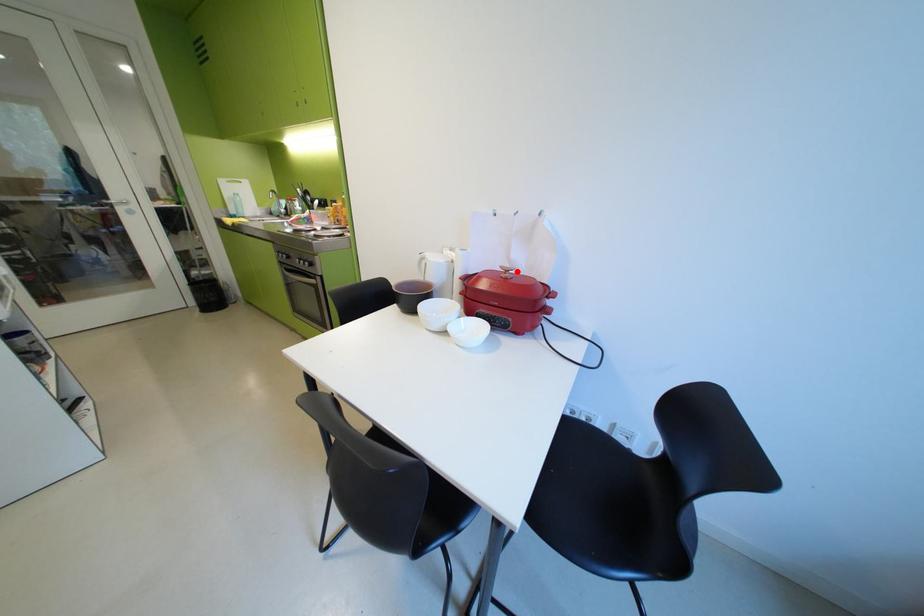
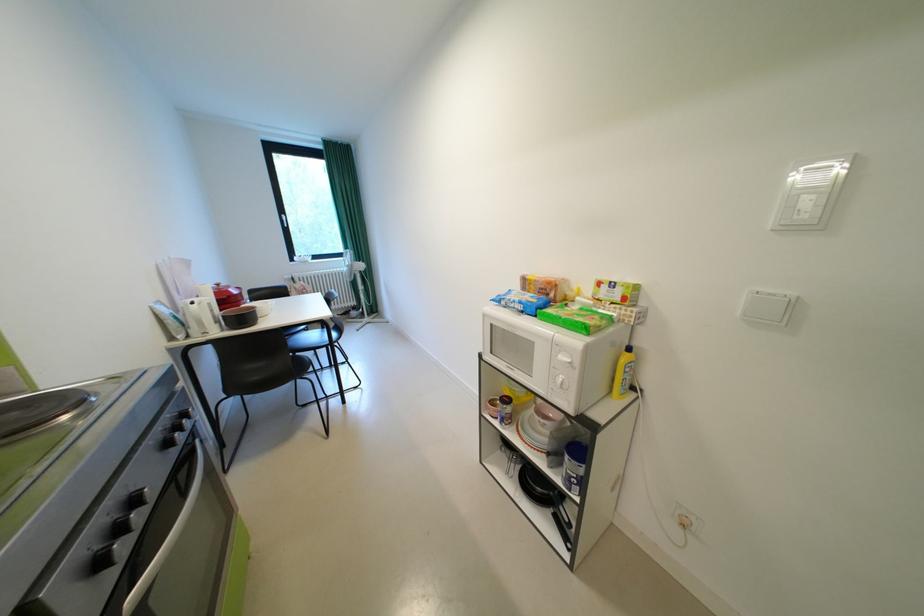
Find the pixel in the second image that matches the highlighted location in the first image.

(228, 286)